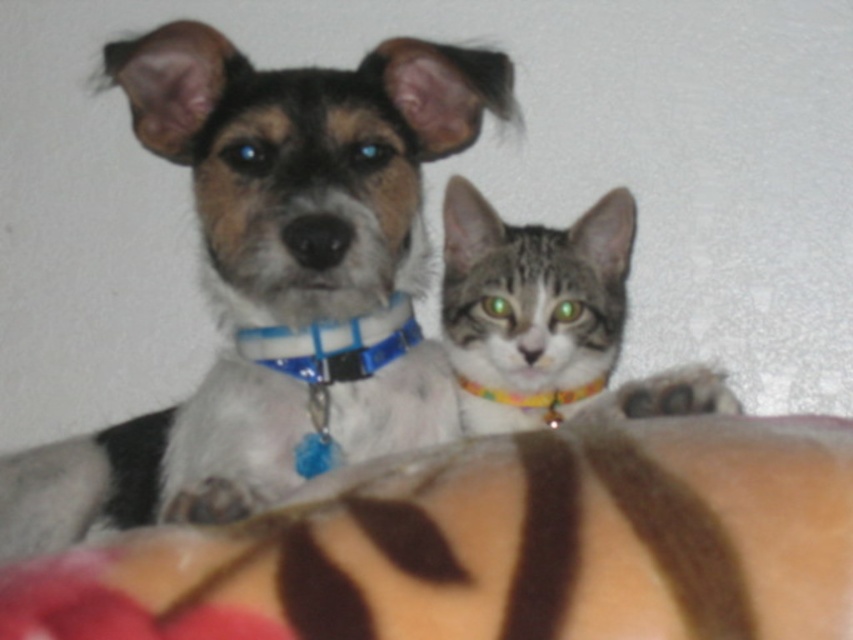
You are a photographer trying to capture a clear shot of both the shiny blue collar at center and the multicolored fabric neckband at center. Given that your camera has a depth of field that can focus on objects within a 10 inch range, will both items be in focus at the same time?

The distance between the shiny blue collar at center and the multicolored fabric neckband at center is 11.09 inches. Since the camera can only focus within a 10 inch range, the two items are slightly out of the depth of field range, so they cannot both be in focus simultaneously.

You are a photographer trying to focus on the tabby fur cat at center. The shiny blue collar at center is blocking your view. Can you shift the collar to the right to get a clear shot of the cat?

The shiny blue collar at center is to the left of the tabby fur cat at center, so moving the collar to the right would allow it to no longer block the cat, providing a clear view.

You are a photographer who wants to focus on the blue plastic collar at center and the multicolored fabric neckband at center in the image. Which one is positioned to the left?

The blue plastic collar at center is positioned to the left of the multicolored fabric neckband at center.